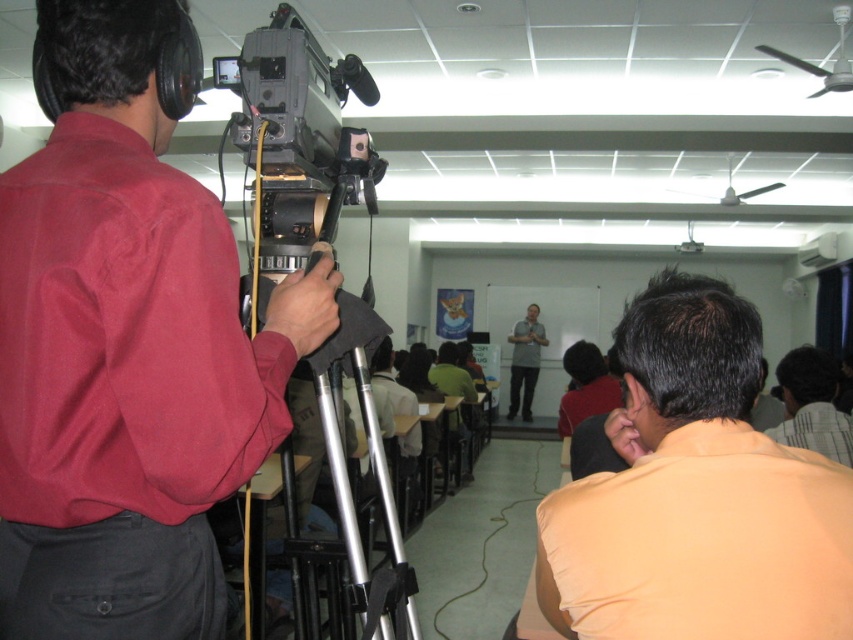
Question: Based on their relative distances, which object is nearer to the gray fabric shirt at center?

Choices:
 (A) striped shirt at lower right
 (B) silver metallic tripod at center
 (C) orange matte shirt at lower right

Answer: (A)

Question: Can you confirm if orange matte shirt at lower right is smaller than gray fabric shirt at center?

Choices:
 (A) yes
 (B) no

Answer: (A)

Question: From the image, what is the correct spatial relationship of striped shirt at lower right in relation to gray fabric shirt at center?

Choices:
 (A) below
 (B) above

Answer: (B)

Question: Is striped shirt at lower right bigger than gray fabric shirt at center?

Choices:
 (A) no
 (B) yes

Answer: (A)

Question: Which of these objects is positioned farthest from the striped shirt at lower right?

Choices:
 (A) gray fabric shirt at center
 (B) matte red shirt at left
 (C) silver metallic tripod at center

Answer: (A)

Question: Which is farther from the matte red shirt at left?

Choices:
 (A) orange matte shirt at lower right
 (B) silver metallic tripod at center
 (C) gray fabric shirt at center
 (D) striped shirt at lower right

Answer: (C)